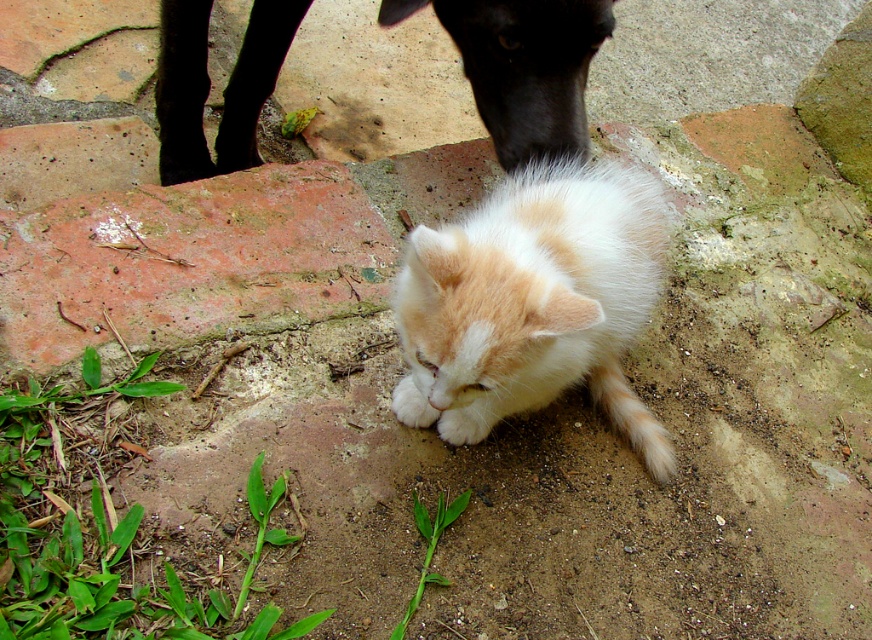
Question: Which of the following is the farthest from the observer?

Choices:
 (A) (478, 422)
 (B) (646, 202)

Answer: (B)

Question: Can you confirm if fluffy orange-white cat at center is positioned to the right of white fluffy paw at center?

Choices:
 (A) no
 (B) yes

Answer: (B)

Question: Among these objects, which one is farthest from the camera?

Choices:
 (A) fluffy orange-white cat at center
 (B) white fluffy paw at center
 (C) white fluffy paw at lower center

Answer: (C)

Question: Which of the following is the closest to the observer?

Choices:
 (A) (634, 428)
 (B) (410, 422)

Answer: (B)

Question: Can you confirm if fluffy orange-white cat at center is positioned above white fluffy paw at lower center?

Choices:
 (A) no
 (B) yes

Answer: (B)

Question: Is fluffy orange-white cat at center to the right of white fluffy paw at lower center from the viewer's perspective?

Choices:
 (A) yes
 (B) no

Answer: (A)